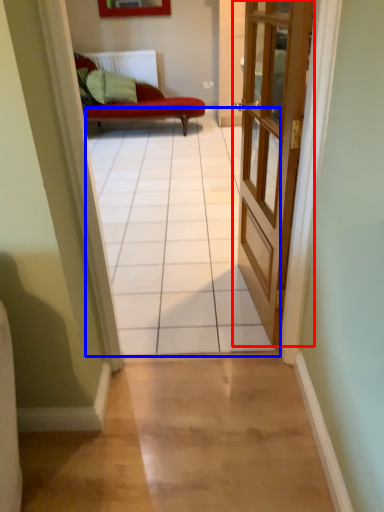
Question: Which point is closer to the camera, door (highlighted by a red box) or path (highlighted by a blue box)?

Choices:
 (A) door
 (B) path

Answer: (B)